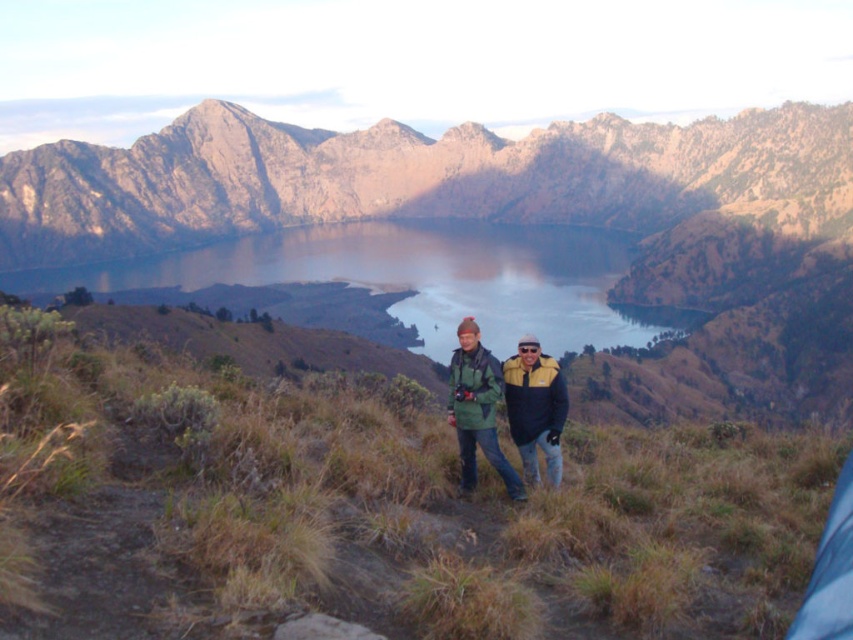
Does blue reflective water at center have a greater width compared to green matte jacket at center?

Yes, blue reflective water at center is wider than green matte jacket at center.

Is point (579, 280) in front of point (480, 380)?

That is False.

This screenshot has height=640, width=853. What are the coordinates of `blue reflective water at center` in the screenshot? It's located at (419, 278).

Can you confirm if brown rocky mountain at upper center is thinner than blue reflective water at center?

No.

Is point (715, 172) farther from camera compared to point (622, 252)?

Yes, point (715, 172) is behind point (622, 252).

In order to click on brown rocky mountain at upper center in this screenshot , I will do `click(401, 177)`.

The image size is (853, 640). In order to click on brown rocky mountain at upper center in this screenshot , I will do `click(401, 177)`.

Does point (22, 156) come closer to viewer compared to point (558, 388)?

No, (22, 156) is behind (558, 388).

Describe the element at coordinates (401, 177) in the screenshot. I see `brown rocky mountain at upper center` at that location.

Is point (270, 212) less distant than point (532, 468)?

No.

Find the location of a particular element. The width and height of the screenshot is (853, 640). brown rocky mountain at upper center is located at coordinates (401, 177).